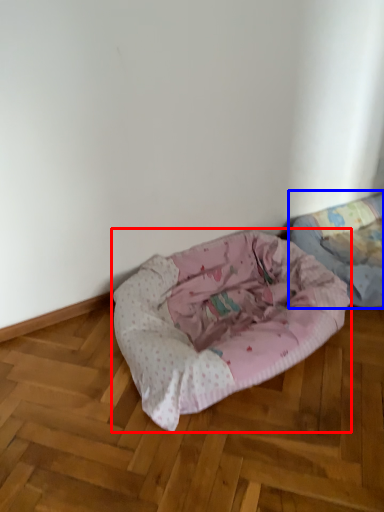
Question: Which object appears closest to the camera in this image, dog bed (highlighted by a red box) or dog bed (highlighted by a blue box)?

Choices:
 (A) dog bed
 (B) dog bed

Answer: (A)